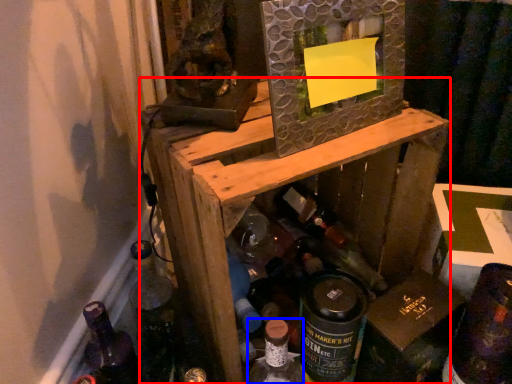
Question: Which point is further to the camera, furniture (highlighted by a red box) or bottle (highlighted by a blue box)?

Choices:
 (A) furniture
 (B) bottle

Answer: (B)